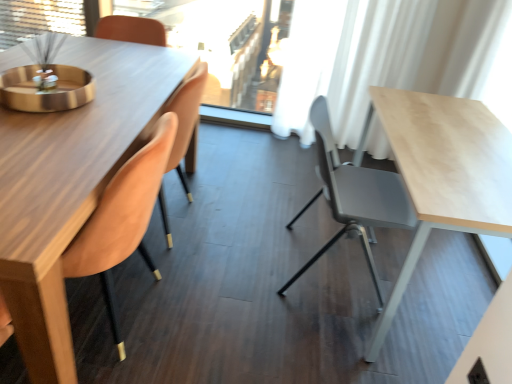
Locate an element on the screen. The image size is (512, 384). vacant area situated to the left side of white sheer curtain at upper right is located at coordinates (260, 148).